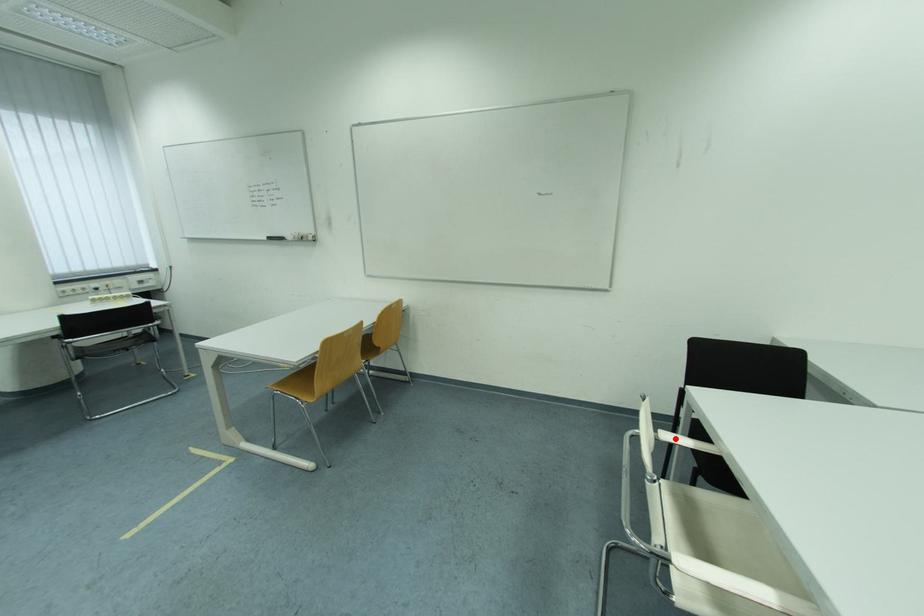
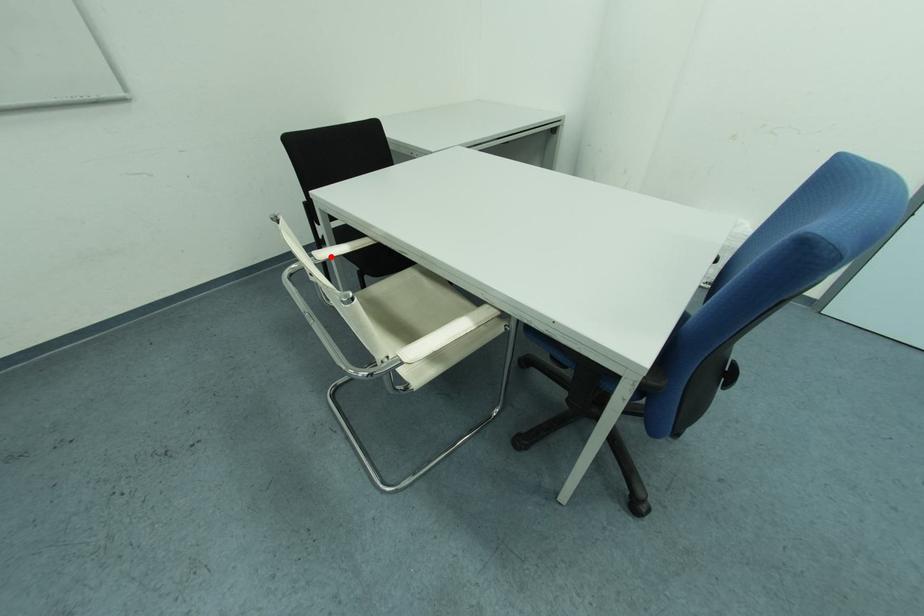
I am providing you with two images of the same scene from different viewpoints. A red point is marked on the first image and another point is marked on the second image. Do the highlighted points in image1 and image2 indicate the same real-world spot?

Yes